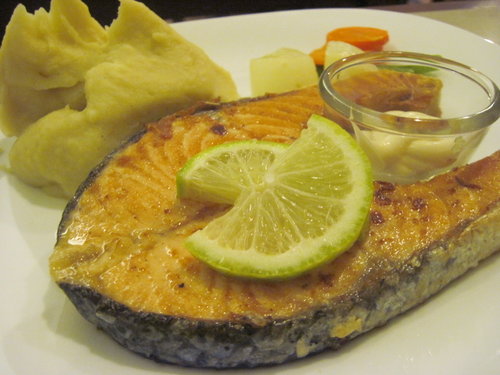
What are the coordinates of `table` in the screenshot? It's located at (43, 316).